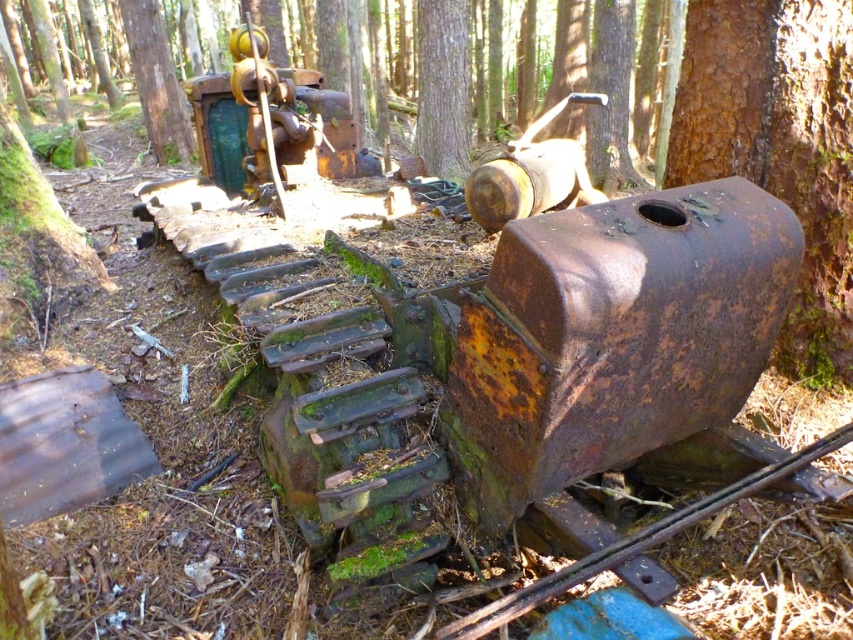
You are standing in the forest near the old machinery. There are two points marked in the scene. Point A is at coordinates point (463, 32) and Point B is at point (166, 44). If you were to walk from Point A to Point B, would you be moving towards the foreground or the background of the image?

Point A is in front of Point B, so moving from Point A to Point B would mean moving towards the background of the image.

You are a hiker who wants to tie a rope between the smooth brown tree trunk at center and the green mossy tree at upper center. Which tree has a thicker trunk to support the rope?

The smooth brown tree trunk at center has a larger width than the green mossy tree at upper center, making it the better choice for supporting the rope.

You are a hiker who needs to navigate between the smooth brown tree trunk at center and the green mossy tree at upper center. Given that your average walking pace is 1.5 meters per second, how many seconds will it take you to walk directly between them?

The smooth brown tree trunk at center is 8.67 meters away from the green mossy tree at upper center. At a pace of 1.5 meters per second, dividing the distance by the speed gives approximately 5.78 seconds. Therefore, it will take roughly 6 seconds to walk between them.